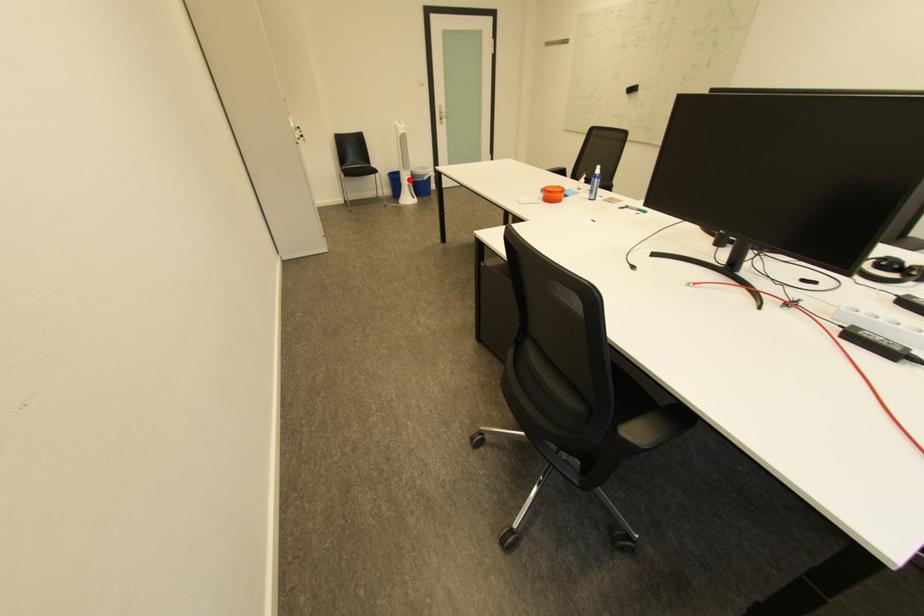
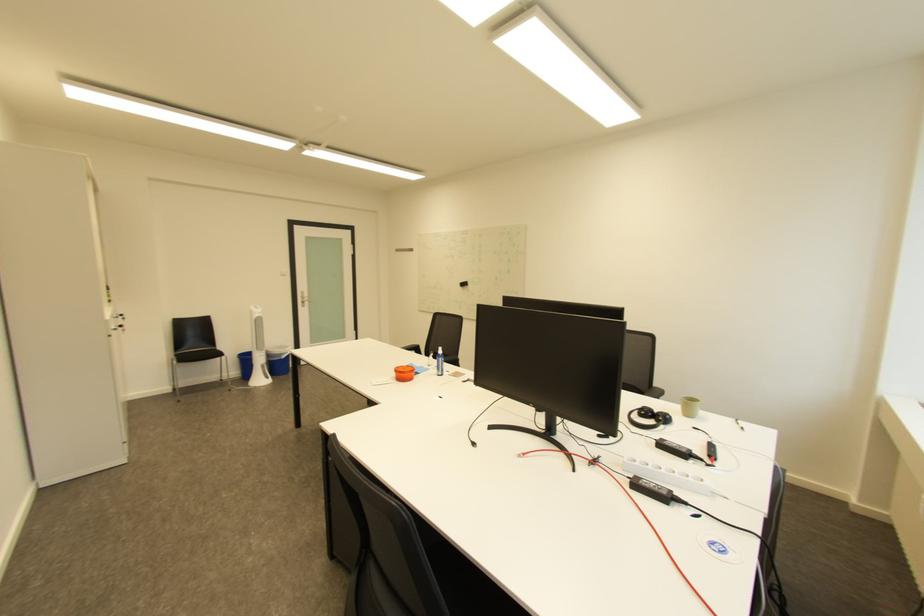
The point at the highlighted location is marked in the first image. Where is the corresponding point in the second image?

(261, 360)